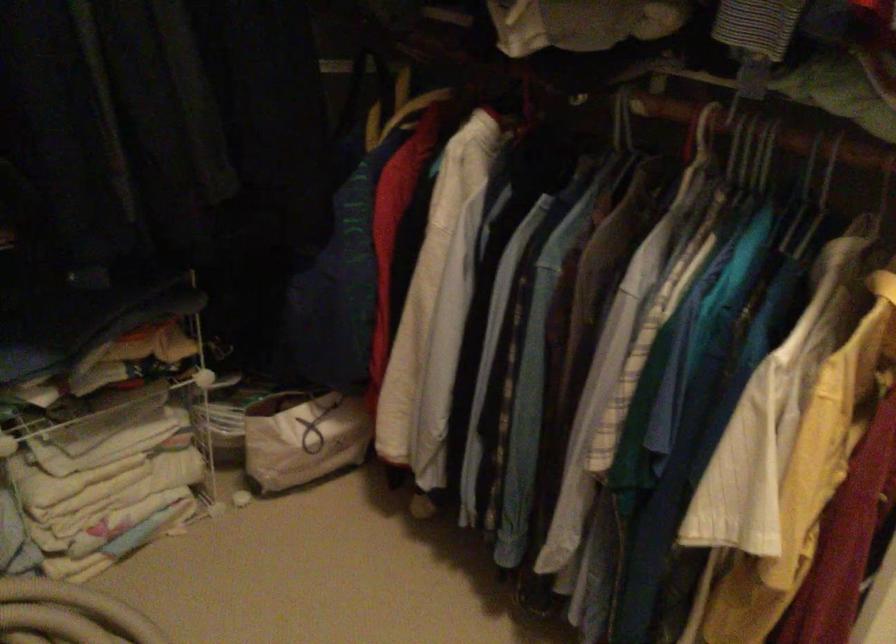
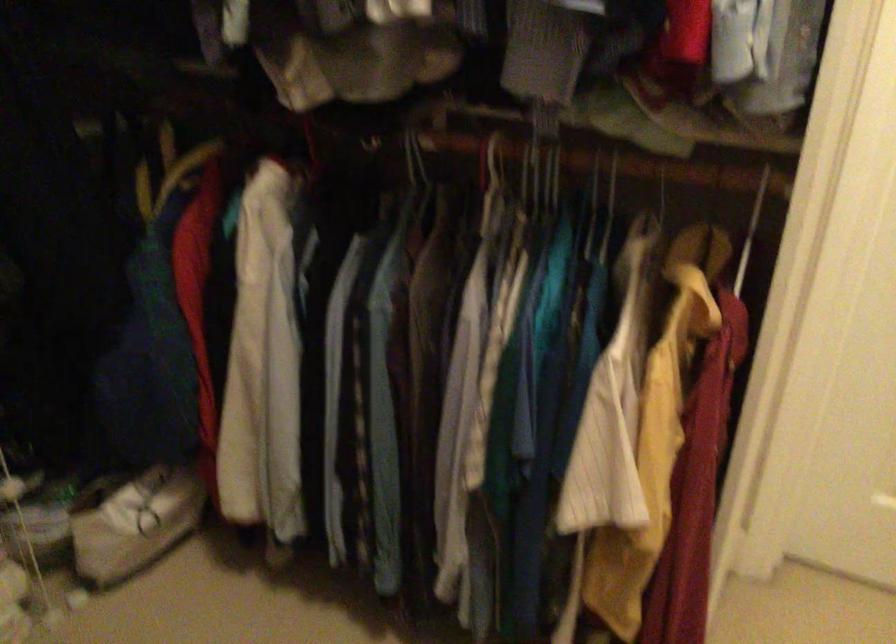
Question: The images are taken continuously from a first-person perspective. In which direction is your viewpoint rotating?

Choices:
 (A) Left
 (B) Right
 (C) Up
 (D) Down

Answer: (B)